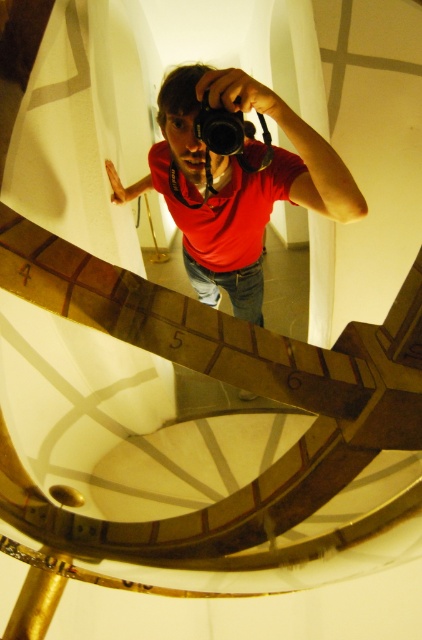
You are a photographer standing 50 centimeters away from the viewer. You want to take a selfie with the matte red shirt at center in focus. Can you adjust your position to ensure the shirt is in focus without moving the shirt?

The matte red shirt at center and viewer are 52.08 centimeters apart from each other. Since you are currently 50 centimeters away, you need to move back approximately 2.08 centimeters to align with the shirt to ensure it is in focus.

You are navigating a drone through a spiral staircase in the image. The drone must fly from the point at the top of the staircase to a lower point. The two points you can choose are point (351, 220) and point (216, 113). According to the image, which point is closer to the starting position at the top of the staircase?

Point (216, 113) is closer to the starting position at the top of the staircase because it is behind point (351, 220), which is further away from the top.